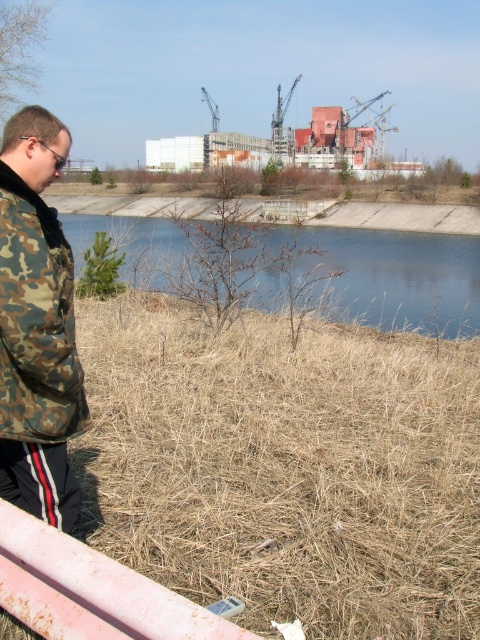
You are the man in the image. You see two points in the scene. The first point is at coordinate point (39, 502) and the second is at point (479, 244). Which point is closer to you?

The point at coordinate point (39, 502) is closer to you because it is in front of point (479, 244).

You are a photographer trying to capture a landscape shot. You notice the camo jacket at left and the blue water at center in your frame. Which object should you focus on if you want to highlight something taller in the scene?

The blue water at center is taller than the camo jacket at left, so focusing on the blue water at center would highlight the taller object in the scene.

You are a photographer trying to capture the man in the camo jacket at left and the blue water at center in the same frame. Based on their positions, which object is closer to the left edge of the photo?

The camo jacket at left is closer to the left edge of the photo because it is positioned to the left of the blue water at center.